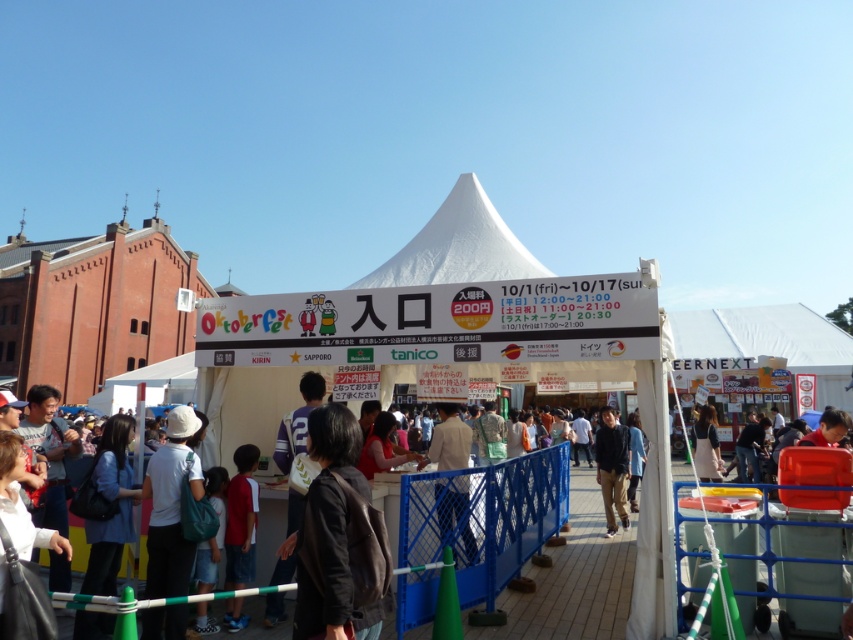
You are at the Oktoberfest event and see two people wearing a red shirt at center and a dark blue jacket at center. Which one is more to the left?

The red shirt at center is more to the left because it is positioned on the left side of the dark blue jacket at center.

You are attending an Oktoberfest event and notice two jackets hanging on a rack near the entrance. The jackets are the black leather jacket at center and the dark blue jacket at center. Which jacket is on top?

The black leather jacket at center is positioned over the dark blue jacket at center, so it is on top.